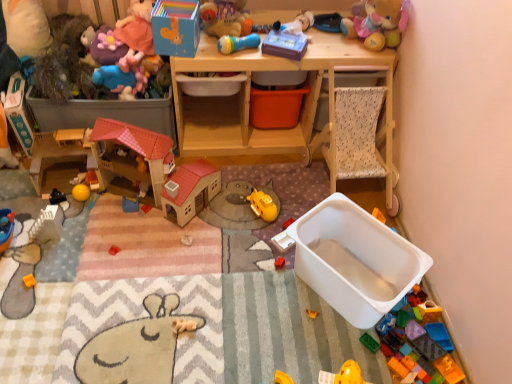
At what (x,y) coordinates should I click in order to perform the action: click on free space to the left of yellow rubber ball at center-left, the second toy positioned from the left. Please return your answer as a coordinate pair (x, y). Looking at the image, I should click on (38, 199).